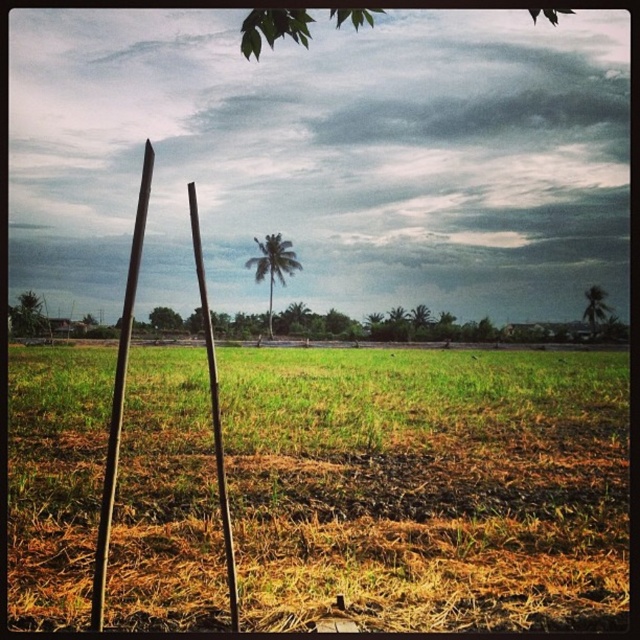
Question: Considering the relative positions of smooth brown pole at center and green leafy coconut tree at right in the image provided, where is smooth brown pole at center located with respect to green leafy coconut tree at right?

Choices:
 (A) above
 (B) below

Answer: (A)

Question: Which of the following is the farthest from the observer?

Choices:
 (A) green leafy tree at center
 (B) smooth brown pole at left
 (C) brown dry grass at center
 (D) green leafy coconut tree at right

Answer: (D)

Question: Which point is closer to the camera?

Choices:
 (A) brown dry grass at center
 (B) smooth brown pole at left

Answer: (B)

Question: Which of the following is the farthest from the observer?

Choices:
 (A) (593, 301)
 (B) (248, 259)
 (C) (193, 198)

Answer: (B)

Question: Does green leafy coconut tree at right appear over green leafy tree at center?

Choices:
 (A) yes
 (B) no

Answer: (A)

Question: Is smooth brown pole at left below green leafy tree at center?

Choices:
 (A) yes
 (B) no

Answer: (B)